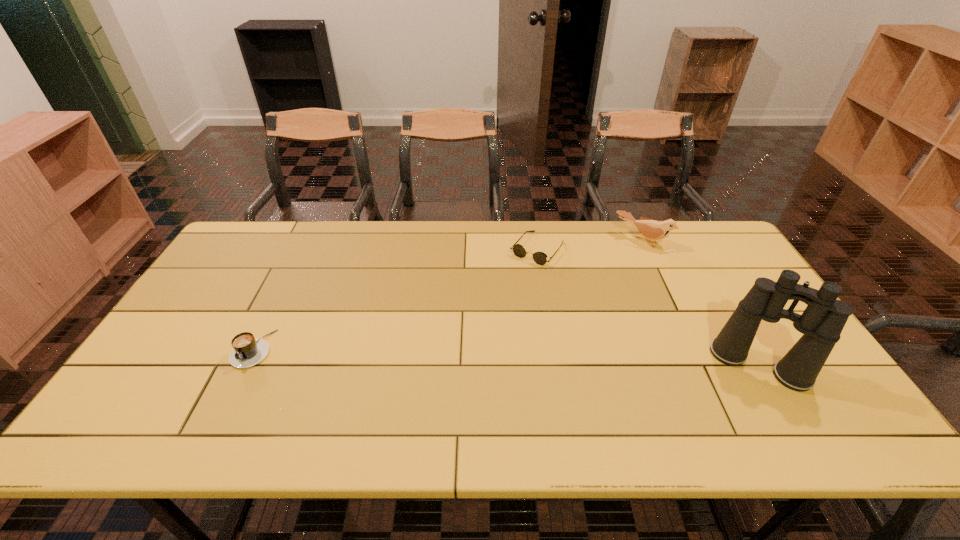
Locate an element on the screen. Image resolution: width=960 pixels, height=540 pixels. empty space between the binoculars and the cappuccino is located at coordinates (506, 357).

At what (x,y) coordinates should I click in order to perform the action: click on free point between the leftmost object and the binoculars. Please return your answer as a coordinate pair (x, y). Looking at the image, I should click on (506, 357).

Locate which object ranks in proximity to the leftmost object. Please provide its 2D coordinates. Your answer should be formatted as a tuple, i.e. [(x, y)], where the tuple contains the x and y coordinates of a point satisfying the conditions above.

[(540, 258)]

The width and height of the screenshot is (960, 540). Identify the location of object that can be found as the closest to the second object from left to right. (654, 230).

Identify the location of vacant space that satisfies the following two spatial constraints: 1. with the handle on the side of the cappuccino; 2. on the right side of the binoculars. (245, 365).

This screenshot has width=960, height=540. Identify the location of free spot that satisfies the following two spatial constraints: 1. with the handle on the side of the tallest object; 2. on the left side of the leftmost object. (245, 365).

In order to click on free space that satisfies the following two spatial constraints: 1. on the front side of the second object from left to right; 2. on the right side of the binoculars in this screenshot , I will do `click(556, 365)`.